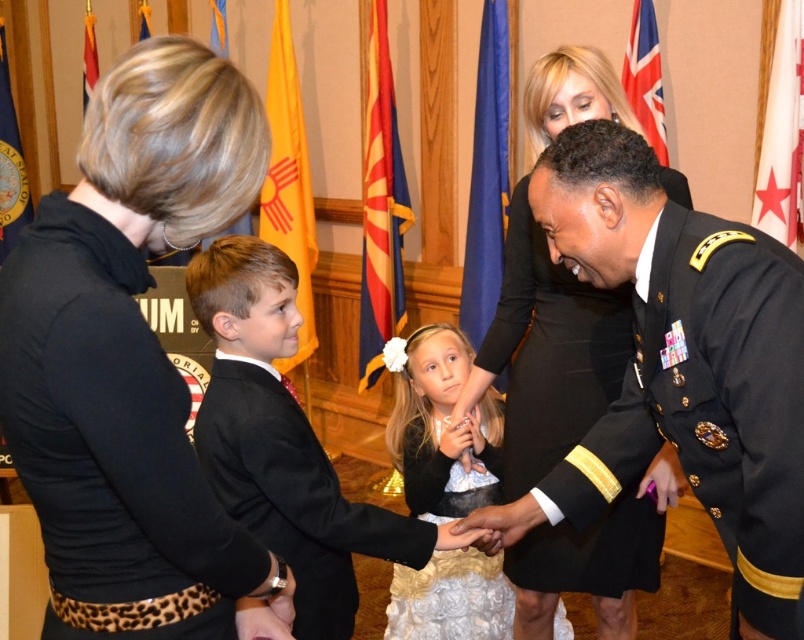
You are an event planner arranging seating for the ceremony. You need to place a chair for the person in the black satin suit at left and another chair for the person in the white satin dress at center. Based on their positions in the image, which chair should be placed to the left of the other?

The black satin suit at left is positioned over the white satin dress at center, so the chair for the black satin suit at left should be placed to the left of the chair for the white satin dress at center.